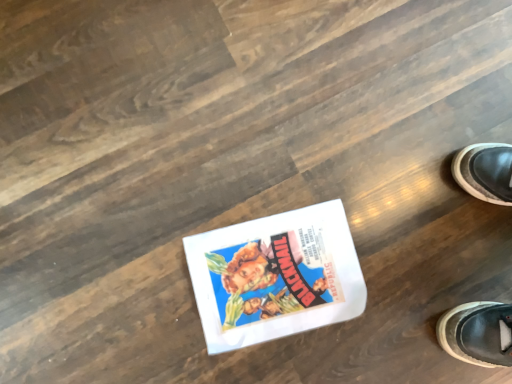
What is the approximate width of matte paper book at center?

matte paper book at center is 12.24 inches wide.

What do you see at coordinates (275, 276) in the screenshot? The image size is (512, 384). I see `matte paper book at center` at bounding box center [275, 276].

You are a GUI agent. You are given a task and a screenshot of the screen. Output one action in this format:
    pyautogui.click(x=<x>, y=<y>)
    Task: Click on the matte paper book at center
    The width and height of the screenshot is (512, 384).
    Given the screenshot: What is the action you would take?
    275,276

Locate an element on the screen. This screenshot has height=384, width=512. matte paper book at center is located at coordinates (275, 276).